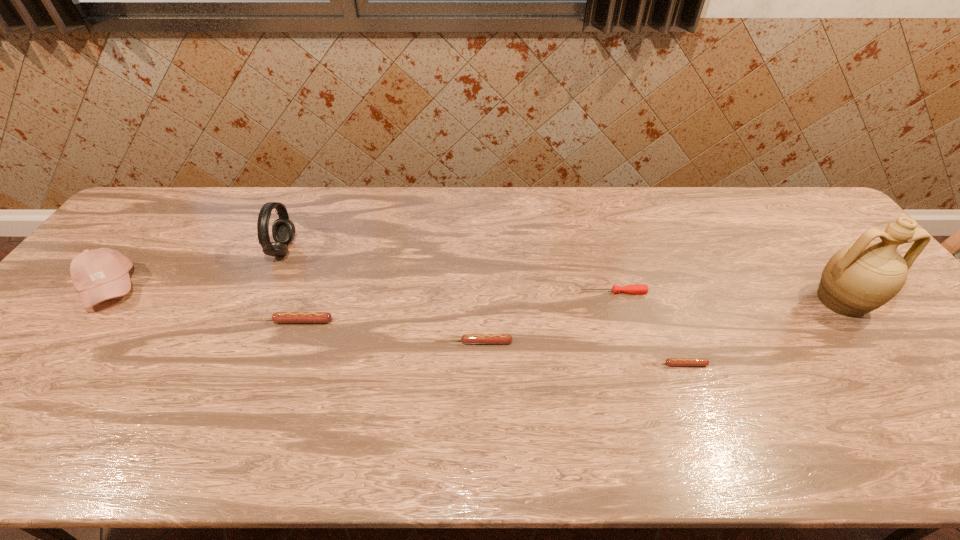
Locate an element on the screen. This screenshot has width=960, height=540. the fourth shortest object is located at coordinates (279, 317).

I want to click on the tallest sausage, so click(279, 317).

You are a GUI agent. You are given a task and a screenshot of the screen. Output one action in this format:
    pyautogui.click(x=<x>, y=<y>)
    Task: Click on the second farthest sausage
    
    Given the screenshot: What is the action you would take?
    pyautogui.click(x=466, y=338)

Locate an element on the screen. The image size is (960, 540). the second nearest object is located at coordinates (466, 338).

I want to click on the shortest sausage, so click(669, 361).

Locate an element on the screen. the nearest object is located at coordinates (669, 361).

The height and width of the screenshot is (540, 960). In order to click on screwdriver in this screenshot , I will do `click(630, 289)`.

Locate an element on the screen. This screenshot has height=540, width=960. pitcher is located at coordinates (860, 277).

The width and height of the screenshot is (960, 540). I want to click on the rightmost object, so click(860, 277).

I want to click on the sixth shortest object, so click(283, 230).